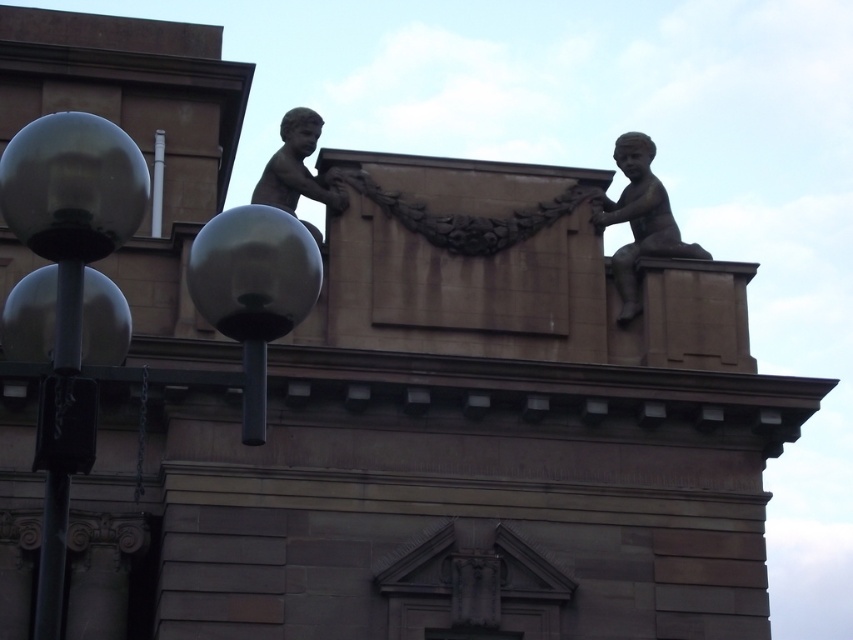
Question: Does metallic gray sphere at left appear under bronze statue at upper right?

Choices:
 (A) no
 (B) yes

Answer: (B)

Question: Can you confirm if matte black sphere at center is smaller than metallic gray pole at left?

Choices:
 (A) yes
 (B) no

Answer: (A)

Question: Which point is closer to the camera?

Choices:
 (A) (695, 253)
 (B) (74, 216)
 (C) (300, 176)

Answer: (B)

Question: Which object is positioned farthest from the matte black sphere at center?

Choices:
 (A) bronze statue at upper right
 (B) bronze statue at upper center
 (C) metallic gray pole at left

Answer: (A)

Question: Can you confirm if matte black sphere at center is positioned to the left of bronze statue at upper center?

Choices:
 (A) no
 (B) yes

Answer: (A)

Question: Among these points, which one is nearest to the camera?

Choices:
 (A) (245, 260)
 (B) (285, 188)
 (C) (13, 212)

Answer: (C)